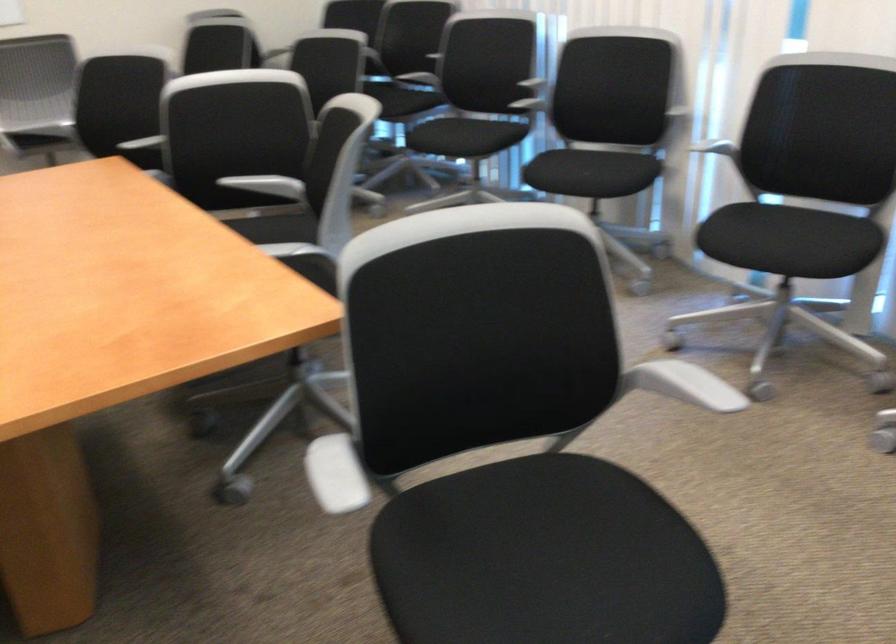
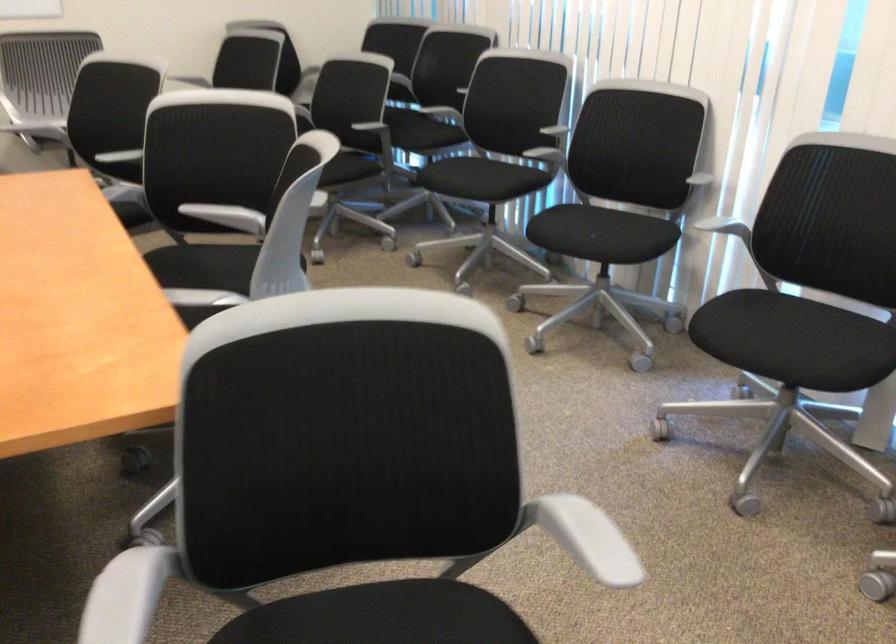
Where in the second image is the point corresponding to pixel 519 100 from the first image?

(543, 146)